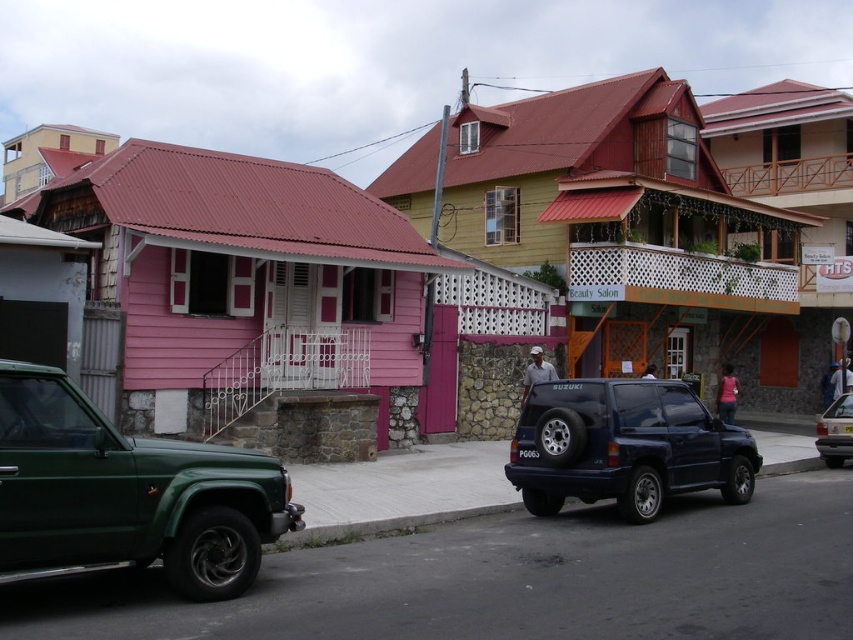
Question: Estimate the real-world distances between objects in this image. Which object is farther from the metallic silver sedan at center?

Choices:
 (A) shiny dark blue suv at center
 (B) green matte pickup truck at lower left

Answer: (B)

Question: Is shiny dark blue suv at center positioned in front of metallic silver sedan at center?

Choices:
 (A) no
 (B) yes

Answer: (B)

Question: Which point is farther to the camera?

Choices:
 (A) (633, 388)
 (B) (837, 444)
 (C) (170, 484)

Answer: (B)

Question: Is green matte pickup truck at lower left to the right of shiny dark blue suv at center from the viewer's perspective?

Choices:
 (A) no
 (B) yes

Answer: (A)

Question: Can you confirm if green matte pickup truck at lower left is positioned to the right of metallic silver sedan at center?

Choices:
 (A) yes
 (B) no

Answer: (B)

Question: Which point is farther from the camera taking this photo?

Choices:
 (A) (74, 493)
 (B) (654, 444)
 (C) (833, 432)

Answer: (C)